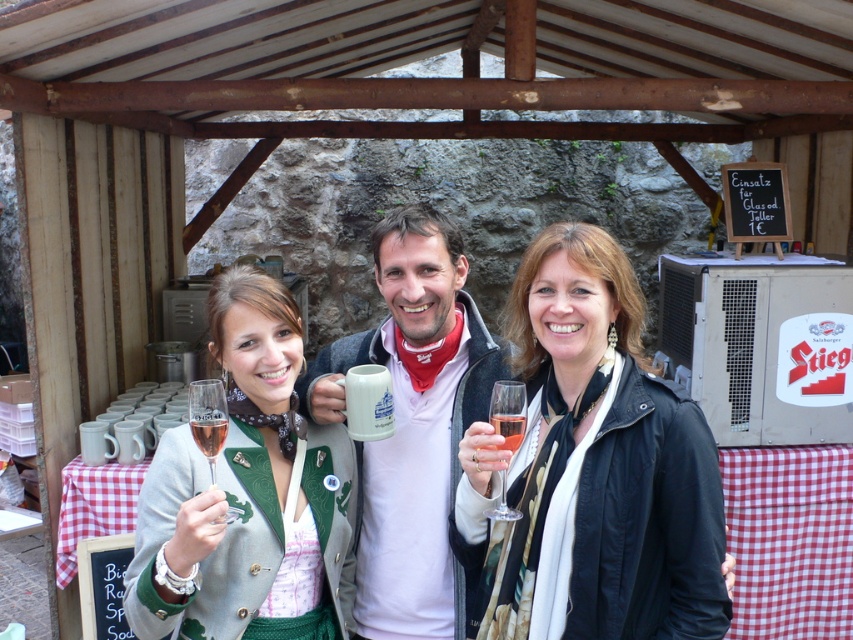
Question: Which point appears farthest from the camera in this image?

Choices:
 (A) (457, 636)
 (B) (515, 429)
 (C) (509, 417)

Answer: (A)

Question: Which point is closer to the camera?

Choices:
 (A) translucent glass wine glass at center
 (B) clear glass champagne flute at lower left
 (C) matte glass wine glass at center
 (D) matte black jacket at center

Answer: (C)

Question: Is matte glass wine glass at center bigger than translucent glass wine glass at center?

Choices:
 (A) no
 (B) yes

Answer: (B)

Question: Is white matte mug at center positioned in front of clear glass wine glass at lower left?

Choices:
 (A) yes
 (B) no

Answer: (B)

Question: Does matte black jacket at center appear under green wool jacket at center?

Choices:
 (A) no
 (B) yes

Answer: (A)

Question: Among these points, which one is farthest from the camera?

Choices:
 (A) (430, 561)
 (B) (503, 508)
 (C) (213, 442)
 (D) (199, 433)

Answer: (A)